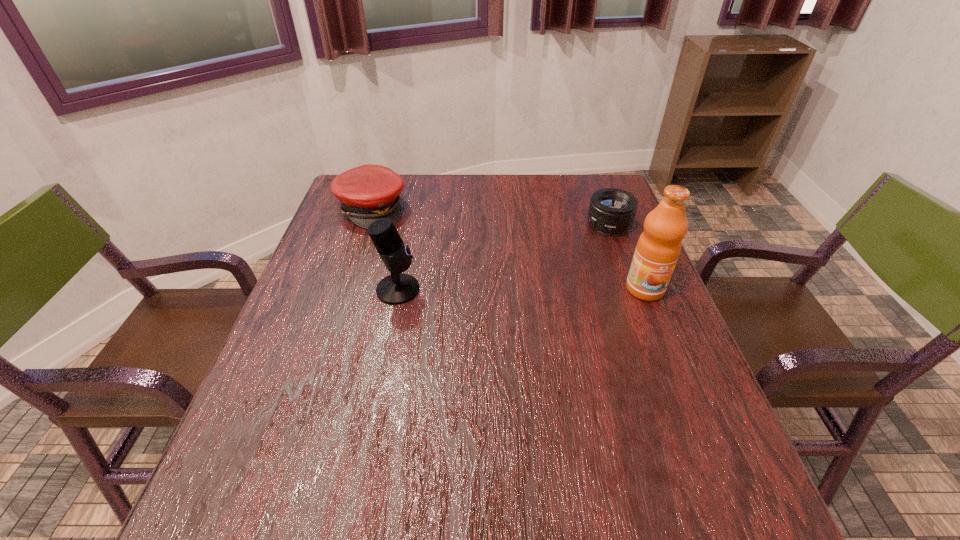
Image resolution: width=960 pixels, height=540 pixels. In order to click on microphone in this screenshot , I will do `click(398, 288)`.

Locate an element on the screen. This screenshot has width=960, height=540. the tallest object is located at coordinates (658, 248).

Where is `cap`? The image size is (960, 540). cap is located at coordinates (369, 192).

Locate an element on the screen. Image resolution: width=960 pixels, height=540 pixels. telephoto lens is located at coordinates (612, 211).

Identify the location of free space located 0.120m on the stand of the third shortest object. The image size is (960, 540). (468, 289).

Identify the location of free location located on the label side of the tallest object. (699, 425).

This screenshot has height=540, width=960. I want to click on vacant space located on the front of the third tallest object with an emblem, so [433, 245].

Find the location of a particular element. Image resolution: width=960 pixels, height=540 pixels. free spot located on the front of the third tallest object with an emblem is located at coordinates (414, 233).

I want to click on vacant region located 0.140m on the front of the third tallest object with an emblem, so click(x=428, y=241).

You are a GUI agent. You are given a task and a screenshot of the screen. Output one action in this format:
    pyautogui.click(x=<x>, y=<y>)
    Task: Click on the free space located on the side of the shortest object with brand markings and control switches
    This screenshot has width=960, height=540.
    Given the screenshot: What is the action you would take?
    pyautogui.click(x=553, y=256)